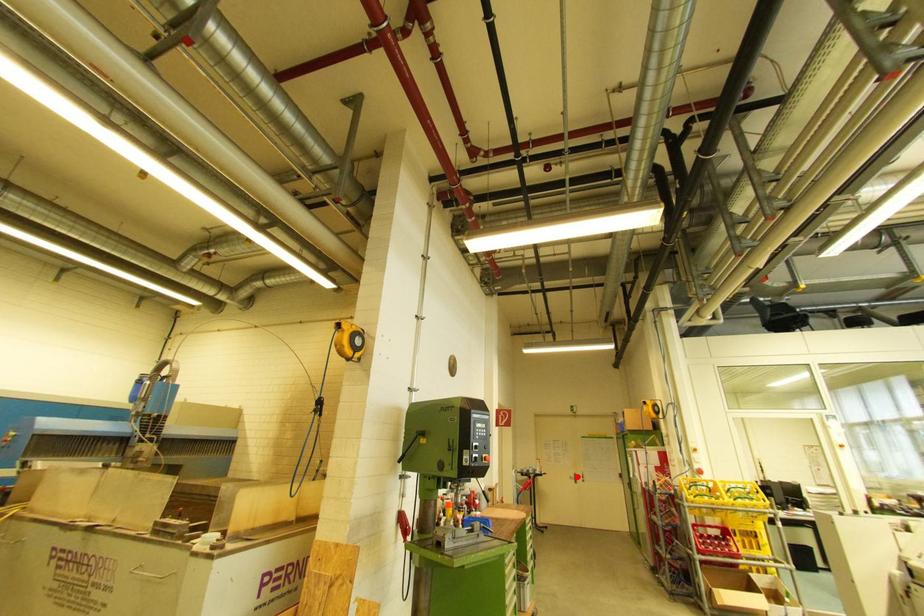
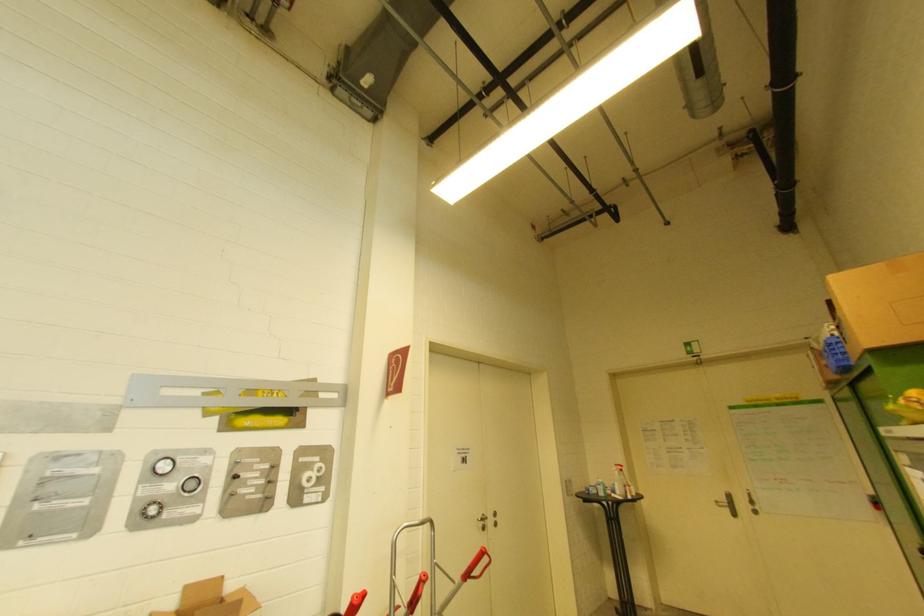
Question: I am providing you with two images of the same scene from different viewpoints. Given a red point in image1, look at the same physical point in image2. Is it:

Choices:
 (A) Closer to the viewpoint
 (B) Farther from the viewpoint

Answer: (A)